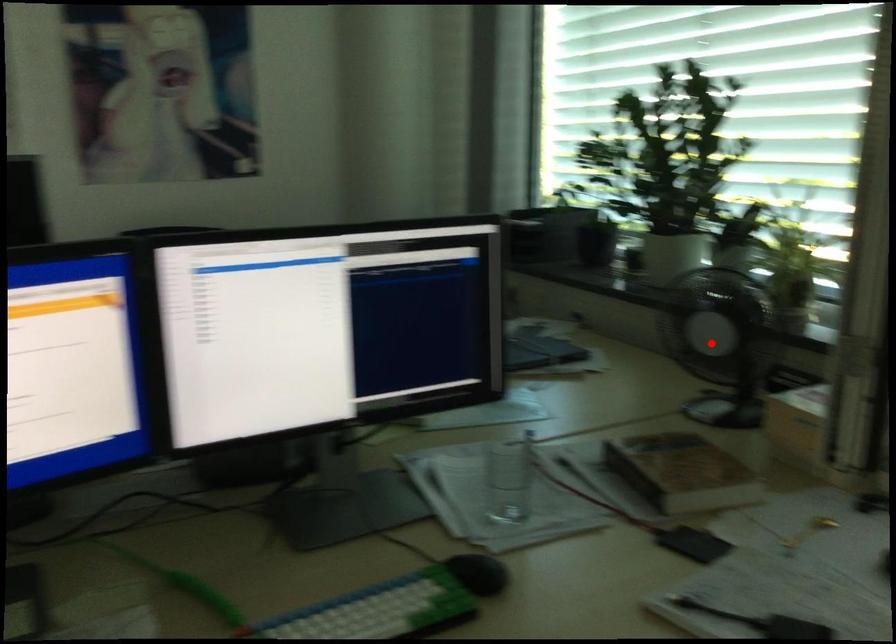
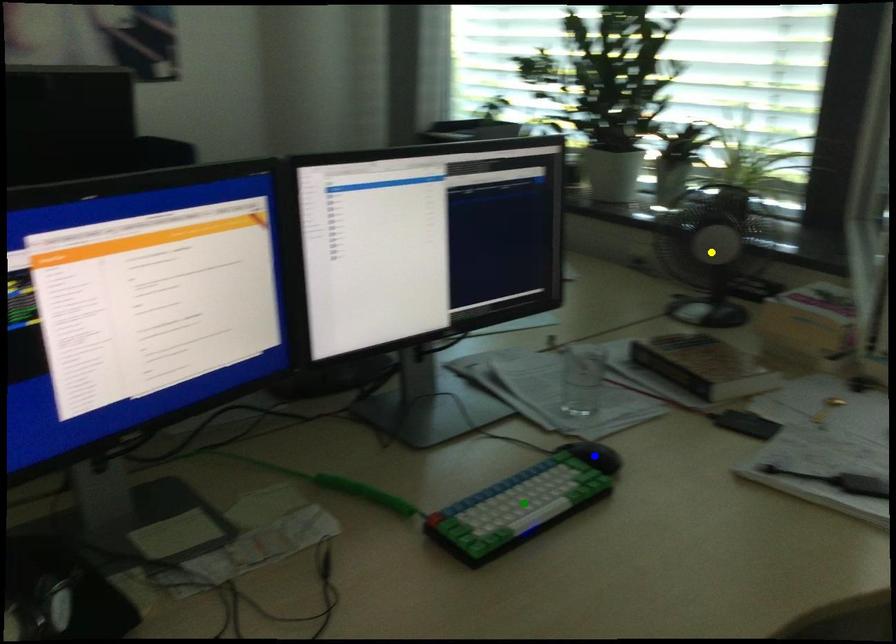
Question: I am providing you with two images of the same scene from different viewpoints. A red point is marked on the first image. You are given multiple points on the second image. In image 2, which mark is for the same physical point as the one in image 1?

Choices:
 (A) yellow point
 (B) blue point
 (C) green point

Answer: (A)